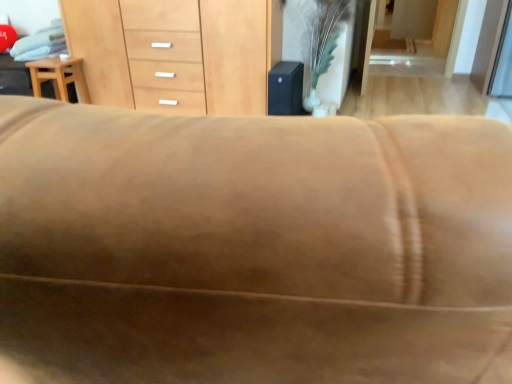
Identify the location of green leafy plant at center. (319, 30).

The image size is (512, 384). Describe the element at coordinates (59, 77) in the screenshot. I see `light brown wood stool at left` at that location.

In order to face light brown wood stool at left, should I rotate leftwards or rightwards?

Rotate your view left by about 24.734°.

Find the location of `green leafy plant at center`. green leafy plant at center is located at coordinates (319, 30).

Does green leafy plant at center turn towards light brown wood chest of drawers at center?

No, green leafy plant at center is not turned towards light brown wood chest of drawers at center.

Which object is positioned more to the right, green leafy plant at center or light brown wood chest of drawers at center?

green leafy plant at center is more to the right.

At what (x,y) coordinates should I click in order to perform the action: click on the chest of drawers lying behind the green leafy plant at center. Please return your answer as a coordinate pair (x, y). The image size is (512, 384). Looking at the image, I should click on (98, 47).

Is point (326, 46) positioned in front of point (115, 16)?

Yes, it is.

Which object is wider, light brown wood chest of drawers at center or green leafy plant at center?

Wider between the two is light brown wood chest of drawers at center.

From a real-world perspective, is light brown wood chest of drawers at center located higher than green leafy plant at center?

No, from a real-world perspective, light brown wood chest of drawers at center is not above green leafy plant at center.

Is light brown wood chest of drawers at center not close to green leafy plant at center?

That's right, there is a large distance between light brown wood chest of drawers at center and green leafy plant at center.

From the image's perspective, between green leafy plant at center and light brown wood stool at left, which one is located above?

From the image's view, green leafy plant at center is above.

Is green leafy plant at center far away from light brown wood stool at left?

Yes, green leafy plant at center and light brown wood stool at left are quite far apart.

Does green leafy plant at center have a smaller size compared to light brown wood stool at left?

Actually, green leafy plant at center might be larger than light brown wood stool at left.

Identify the location of plant located on the right of light brown wood stool at left. (319, 30).

Do you think light brown wood chest of drawers at center is within light brown wood stool at left, or outside of it?

light brown wood chest of drawers at center lies outside light brown wood stool at left.

Which is more to the right, light brown wood chest of drawers at center or light brown wood stool at left?

light brown wood chest of drawers at center.

Is light brown wood chest of drawers at center not close to light brown wood stool at left?

No, light brown wood chest of drawers at center is not far from light brown wood stool at left.

Is the position of light brown wood stool at left less distant than that of green leafy plant at center?

No.

Considering the positions of points (53, 79) and (333, 3), is point (53, 79) closer to camera compared to point (333, 3)?

No.

Is green leafy plant at center located within light brown wood stool at left?

No.

From a real-world perspective, between light brown wood stool at left and light brown wood chest of drawers at center, who is vertically lower?

From a 3D spatial view, light brown wood stool at left is below.

Locate an element on the screen. The width and height of the screenshot is (512, 384). the chest of drawers located above the light brown wood stool at left (from the image's perspective) is located at coordinates (98, 47).

Which is correct: light brown wood stool at left is inside light brown wood chest of drawers at center, or outside of it?

light brown wood stool at left is spatially situated outside light brown wood chest of drawers at center.

Considering the relative sizes of light brown wood stool at left and light brown wood chest of drawers at center in the image provided, is light brown wood stool at left taller than light brown wood chest of drawers at center?

Incorrect, the height of light brown wood stool at left is not larger of that of light brown wood chest of drawers at center.

The height and width of the screenshot is (384, 512). What are the coordinates of `the chest of drawers located underneath the green leafy plant at center (from a real-world perspective)` in the screenshot? It's located at (98, 47).

Find the location of a particular element. This screenshot has width=512, height=384. plant above the light brown wood chest of drawers at center (from a real-world perspective) is located at coordinates (319, 30).

Which object lies nearer to the anchor point light brown wood chest of drawers at center, light brown wood stool at left or green leafy plant at center?

Based on the image, light brown wood stool at left appears to be nearer to light brown wood chest of drawers at center.

In the scene shown: When comparing their distances from light brown wood chest of drawers at center, does green leafy plant at center or light brown wood stool at left seem further?

green leafy plant at center.

Estimate the real-world distances between objects in this image. Which object is further from light brown wood stool at left, light brown wood chest of drawers at center or green leafy plant at center?

green leafy plant at center.

From the image, which object appears to be nearer to light brown wood stool at left, green leafy plant at center or light brown wood chest of drawers at center?

Based on the image, light brown wood chest of drawers at center appears to be nearer to light brown wood stool at left.

Estimate the real-world distances between objects in this image. Which object is closer to green leafy plant at center, light brown wood chest of drawers at center or light brown wood stool at left?

The object closer to green leafy plant at center is light brown wood chest of drawers at center.

Based on their spatial positions, is light brown wood stool at left or light brown wood chest of drawers at center closer to green leafy plant at center?

light brown wood chest of drawers at center.

The width and height of the screenshot is (512, 384). I want to click on chest of drawers between light brown wood stool at left and green leafy plant at center, so click(x=98, y=47).